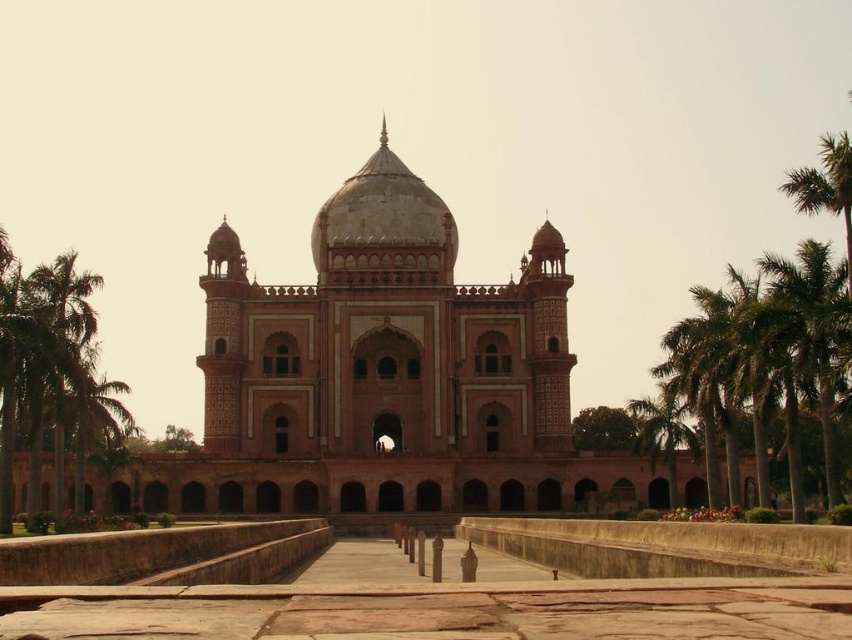
What do you see at coordinates (50, 384) in the screenshot? Image resolution: width=852 pixels, height=640 pixels. I see `green leafy palm tree at left` at bounding box center [50, 384].

Which is behind, point (32, 508) or point (655, 444)?

The point (655, 444) is more distant.

I want to click on green leafy palm tree at left, so click(50, 384).

What do you see at coordinates (384, 378) in the screenshot? I see `pink stone palace at center` at bounding box center [384, 378].

Which of these two, pink stone palace at center or green leafy palm tree at left, stands taller?

Standing taller between the two is pink stone palace at center.

What do you see at coordinates (384, 378) in the screenshot?
I see `pink stone palace at center` at bounding box center [384, 378].

Locate an element on the screen. pink stone palace at center is located at coordinates (384, 378).

Does point (576, 483) come in front of point (669, 490)?

Yes, it is.

What do you see at coordinates (384, 378) in the screenshot? I see `pink stone palace at center` at bounding box center [384, 378].

Who is more distant from viewer, (528, 262) or (666, 490)?

Point (528, 262)

The width and height of the screenshot is (852, 640). Find the location of `pink stone palace at center`. pink stone palace at center is located at coordinates (384, 378).